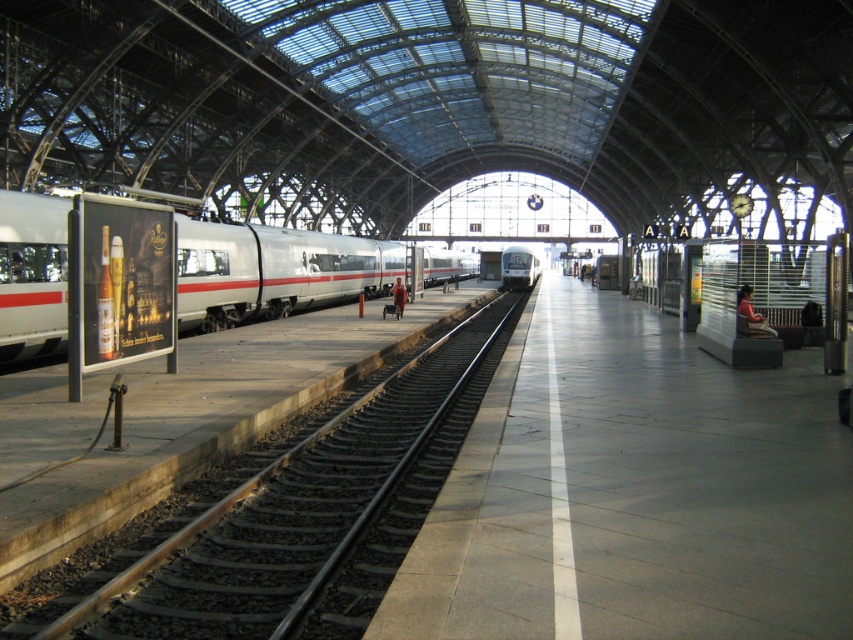
You are standing at point (283, 513) in the train station. What object is directly in front of you?

The smooth steel train track at left is located at point (283, 513), so the object directly in front of you is the smooth steel train track at left.

You are standing at the point marked by point (273, 269) in the train station. Which direction should you walk to reach the silver metallic train at left?

The silver metallic train at left is represented by point (273, 269), so you are already at the location of the silver metallic train at left.

You are standing on the platform of the train station and want to cross to the other side. The smooth steel train track at left is the only obstacle. Can you safely walk around it if you are 1.7 meters tall?

The smooth steel train track at left is 4.69 meters away from viewer. Since the distance is greater than your height, you can safely walk around it without any issues.